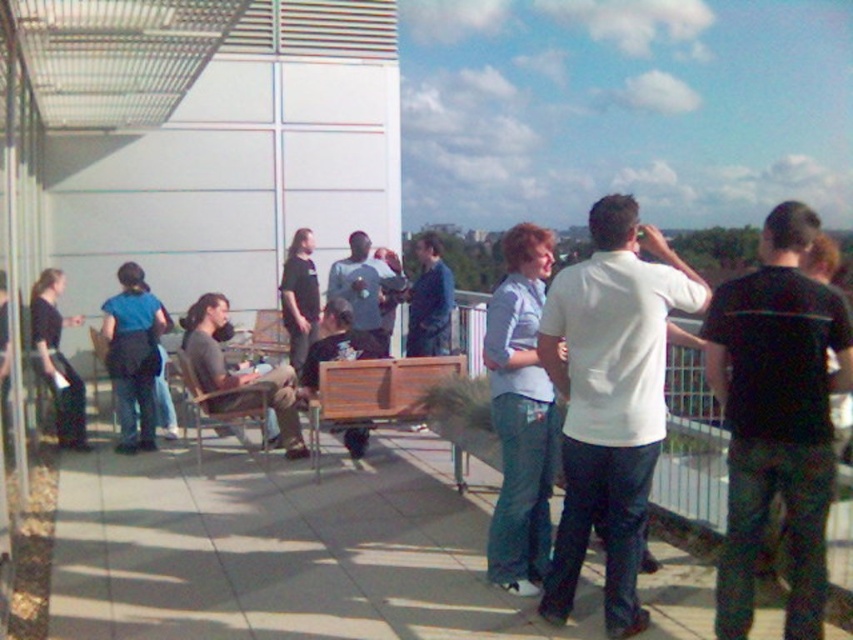
In the scene shown: You are organizing a photoshoot and need to arrange two models wearing the white matte shirt at center and blue denim jacket at center. According to the scene, which model should stand to the left to maintain the original composition?

The blue denim jacket at center should stand to the left because the white matte shirt at center is positioned on the right side of the blue denim jacket at center in the original scene.

You are a photographer trying to capture a group photo of the people on the rooftop. You notice the white matte shirt at center and the blue denim jacket at center. Which clothing item would you adjust to ensure better visibility in the photo?

The white matte shirt at center is thinner than the blue denim jacket at center, so adjusting the white matte shirt at center might help improve its visibility as it may appear less bulky in the photo.